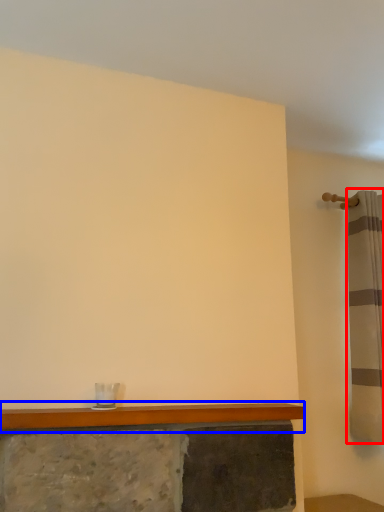
Question: Which point is closer to the camera, shower curtain (highlighted by a red box) or counter top (highlighted by a blue box)?

Choices:
 (A) shower curtain
 (B) counter top

Answer: (B)